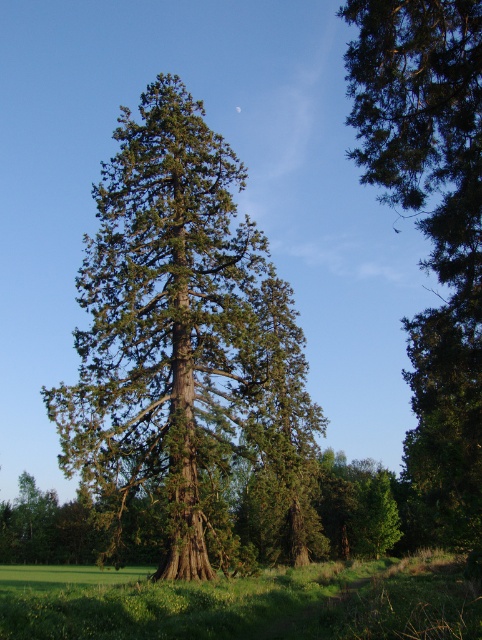
You are a bird flying over the green grassy field at lower center and want to land on the green rough bark tree at center. Which direction should you fly to reach the tree?

The green rough bark tree at center is above the green grassy field at lower center, so you should fly upward to reach the tree.